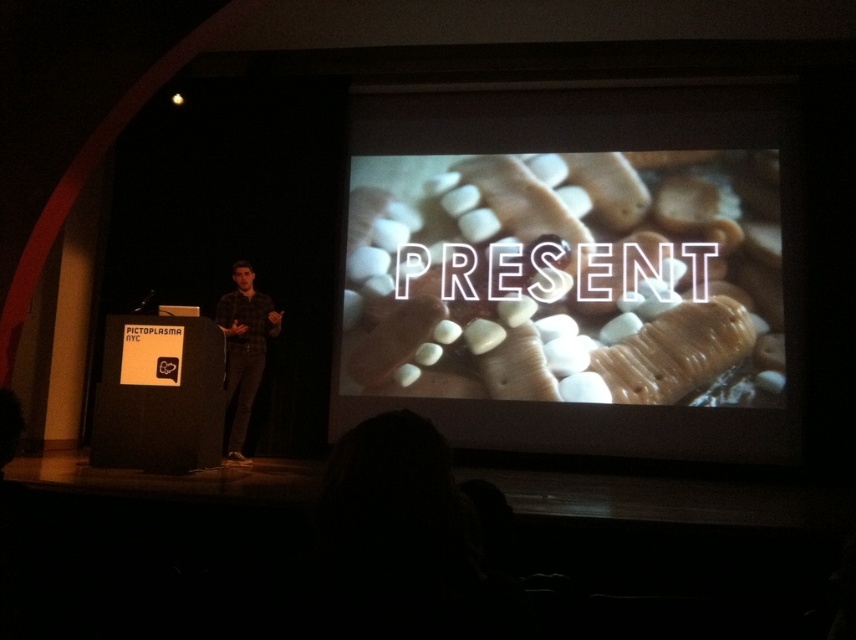
Question: Where is white matte marshmallows at center located in relation to plaid shirt at center in the image?

Choices:
 (A) above
 (B) below

Answer: (A)

Question: Which point appears closest to the camera in this image?

Choices:
 (A) (688, 120)
 (B) (223, 301)

Answer: (B)

Question: In this image, where is white matte marshmallows at center located relative to plaid shirt at center?

Choices:
 (A) below
 (B) above

Answer: (B)

Question: Does white matte marshmallows at center have a larger size compared to plaid shirt at center?

Choices:
 (A) yes
 (B) no

Answer: (A)